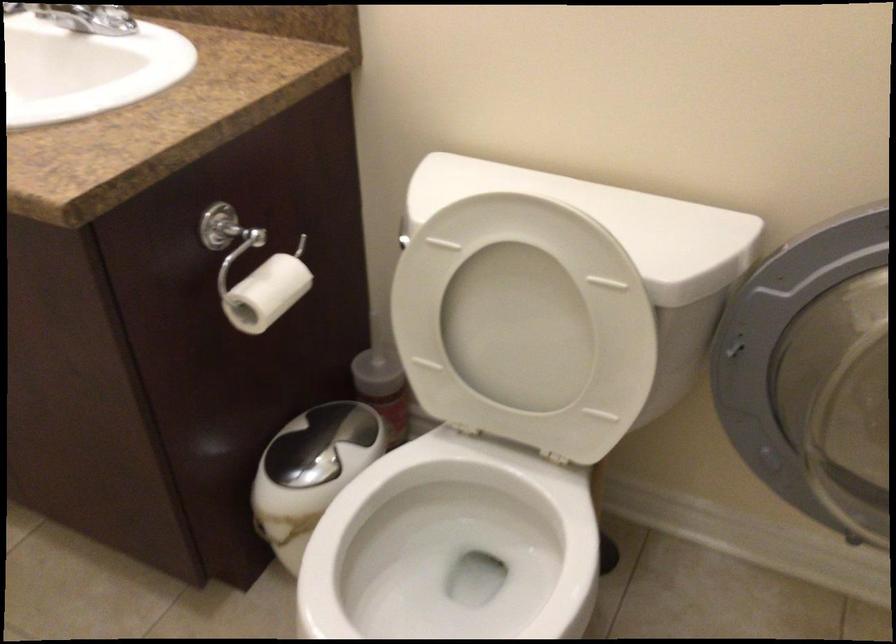
What do you see at coordinates (306, 451) in the screenshot?
I see `the silver trash can lid` at bounding box center [306, 451].